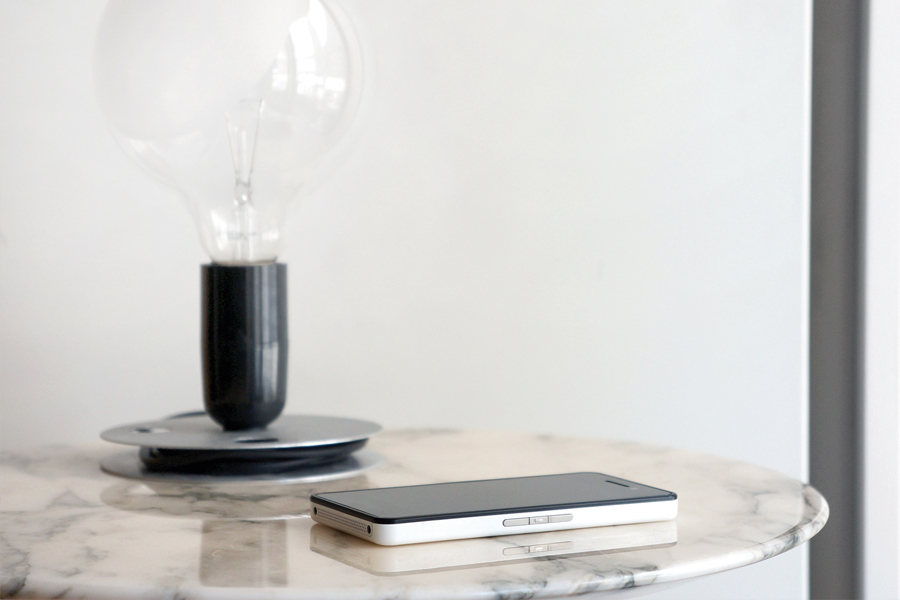
Identify the location of table. (229, 538).